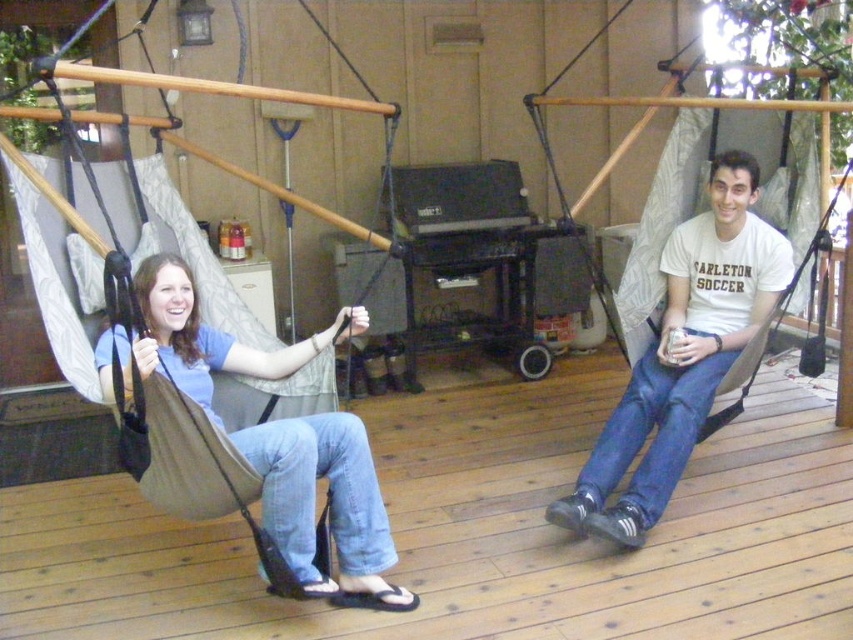
From the picture: You are standing on the wooden deck at center and want to reach the matte beige hammock at left. Which direction should you move to get closer to the hammock?

The wooden deck at center is below the matte beige hammock at left, so you should move upward to reach the hammock.